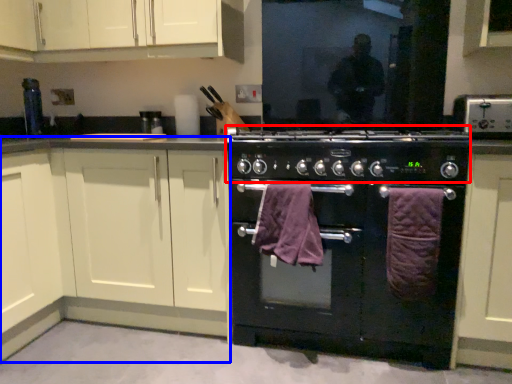
Question: Which of the following is the farthest to the observer, appliance (highlighted by a red box) or cabinetry (highlighted by a blue box)?

Choices:
 (A) appliance
 (B) cabinetry

Answer: (B)